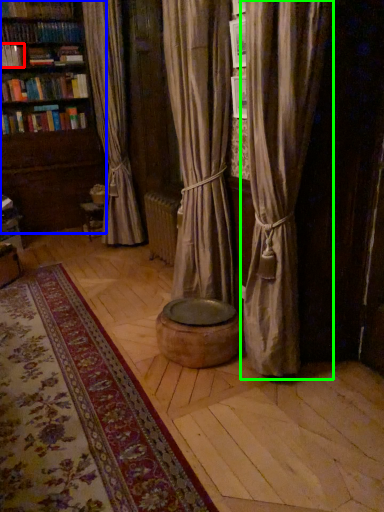
Question: Which object is the closest to the book (highlighted by a red box)? Choose among these: bookcase (highlighted by a blue box) or curtain (highlighted by a green box).

Choices:
 (A) bookcase
 (B) curtain

Answer: (A)